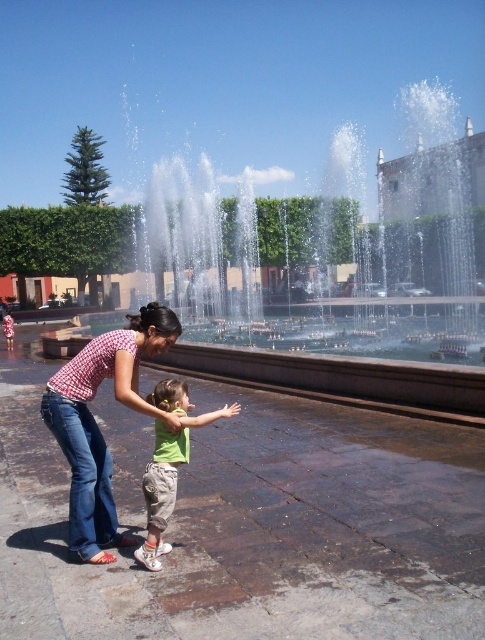
Question: Can you confirm if clear water jets at center is positioned to the left of green fabric shirt at center?

Choices:
 (A) yes
 (B) no

Answer: (B)

Question: Does clear water jets at center lie in front of denim jeans at center?

Choices:
 (A) no
 (B) yes

Answer: (A)

Question: Is clear water jets at center bigger than denim jeans at center?

Choices:
 (A) no
 (B) yes

Answer: (B)

Question: Which of the following is the closest to the observer?

Choices:
 (A) 136,339
 (B) 187,433
 (C) 307,260

Answer: (B)

Question: Which of the following is the farthest from the observer?

Choices:
 (A) (341, 157)
 (B) (157, 531)
 (C) (82, 490)

Answer: (A)

Question: Estimate the real-world distances between objects in this image. Which object is closer to the denim jeans at center?

Choices:
 (A) green fabric shirt at center
 (B) clear water jets at center

Answer: (A)